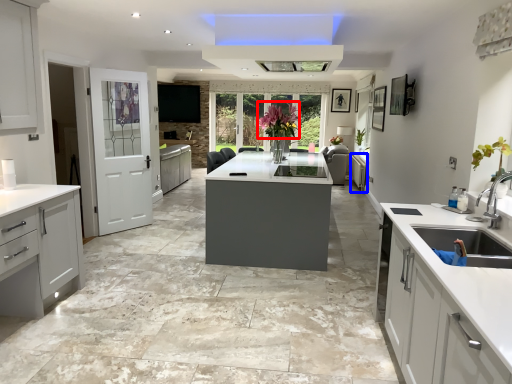
Question: Which object is closer to the camera taking this photo, floral arrangement (highlighted by a red box) or cabinetry (highlighted by a blue box)?

Choices:
 (A) floral arrangement
 (B) cabinetry

Answer: (A)